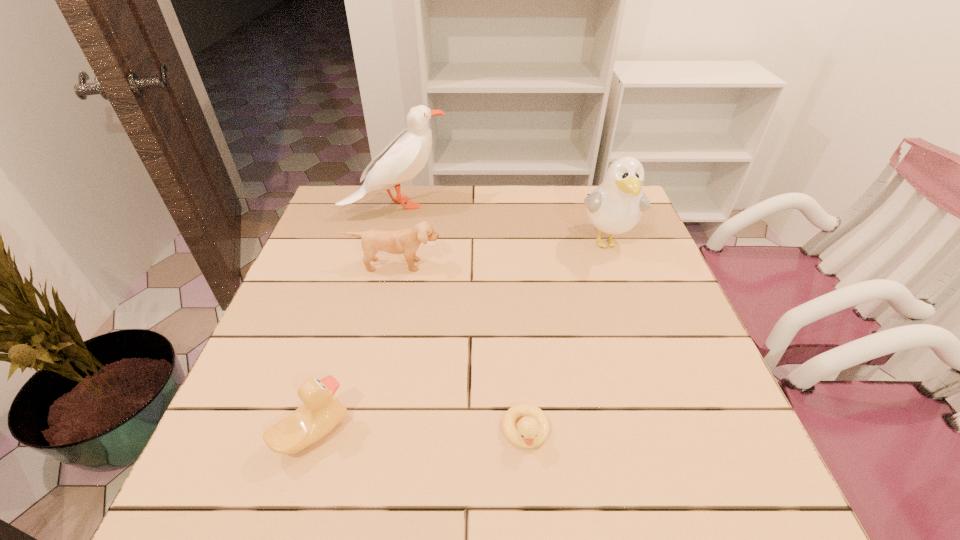
Identify the location of vacant space situated on the left side of the puppy. (372, 367).

The width and height of the screenshot is (960, 540). What are the coordinates of `free space located at the beak of the duck` in the screenshot? It's located at (546, 432).

This screenshot has height=540, width=960. I want to click on vacant space located at the beak of the duckling, so click(531, 499).

The height and width of the screenshot is (540, 960). I want to click on object situated at the near edge, so click(321, 411).

Where is `gull at the left edge`? This screenshot has height=540, width=960. gull at the left edge is located at coordinates (406, 155).

In order to click on puppy that is positioned at the left edge in this screenshot , I will do `click(406, 241)`.

Locate an element on the screen. duck located at the left edge is located at coordinates (321, 411).

Where is `object that is positioned at the right edge`? object that is positioned at the right edge is located at coordinates (616, 205).

Locate an element on the screen. object that is positioned at the far left corner is located at coordinates (406, 155).

You are a GUI agent. You are given a task and a screenshot of the screen. Output one action in this format:
    pyautogui.click(x=<x>, y=<y>)
    Task: Click on the object present at the near left corner
    The height and width of the screenshot is (540, 960).
    Given the screenshot: What is the action you would take?
    pyautogui.click(x=321, y=411)